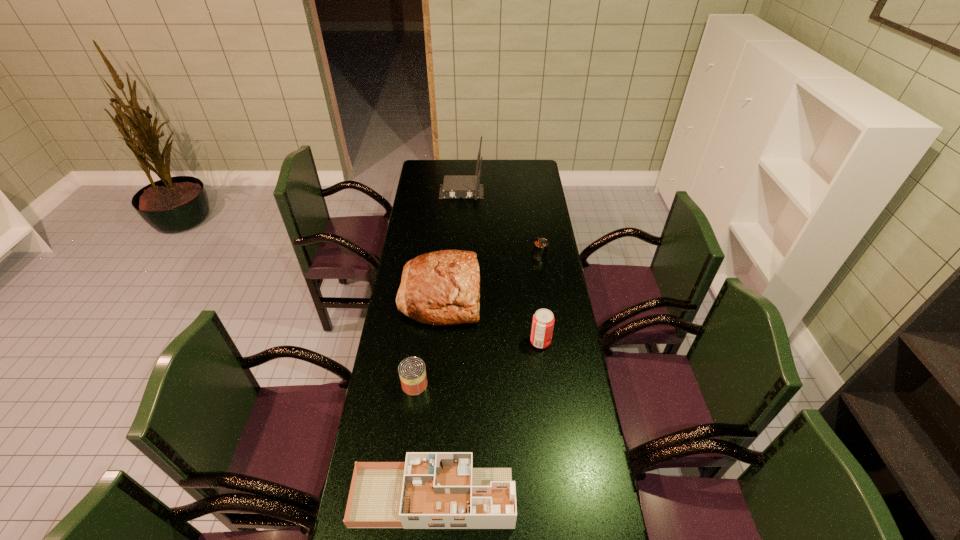
Where is `vacant area that lies between the nearest object and the farthest object`? This screenshot has width=960, height=540. vacant area that lies between the nearest object and the farthest object is located at coordinates (447, 345).

Where is `vacant region between the dollhouse and the third nearest object`? vacant region between the dollhouse and the third nearest object is located at coordinates (487, 420).

The image size is (960, 540). Find the location of `blank region between the bread and the fourth shortest object`. blank region between the bread and the fourth shortest object is located at coordinates coord(491,318).

Find the location of a particular element. free space between the router and the nearest object is located at coordinates (447, 345).

Identify which object is the third closest to the tallest object. Please provide its 2D coordinates. Your answer should be formatted as a tuple, i.e. [(x, y)], where the tuple contains the x and y coordinates of a point satisfying the conditions above.

[(543, 320)]

Locate which object ranks fourth in proximity to the router. Please provide its 2D coordinates. Your answer should be formatted as a tuple, i.e. [(x, y)], where the tuple contains the x and y coordinates of a point satisfying the conditions above.

[(412, 372)]

At what (x,y) coordinates should I click in order to perform the action: click on free space that satisfies the following two spatial constraints: 1. on the back of the router to connect cables; 2. at the front door of the dollhouse. Please return your answer as a coordinate pair (x, y). The height and width of the screenshot is (540, 960). Looking at the image, I should click on (445, 497).

Identify the location of vacant space that satisfies the following two spatial constraints: 1. on the back side of the third tallest object; 2. at the sliced front of the second tallest object. (535, 294).

Identify the location of free space that satisfies the following two spatial constraints: 1. on the back of the router to connect cables; 2. on the left side of the third nearest object. This screenshot has width=960, height=540. (453, 342).

Where is `blank space that satisfies the following two spatial constraints: 1. on the back of the farthest object to connect cables; 2. at the sliced front of the bread`? Image resolution: width=960 pixels, height=540 pixels. blank space that satisfies the following two spatial constraints: 1. on the back of the farthest object to connect cables; 2. at the sliced front of the bread is located at coordinates (456, 294).